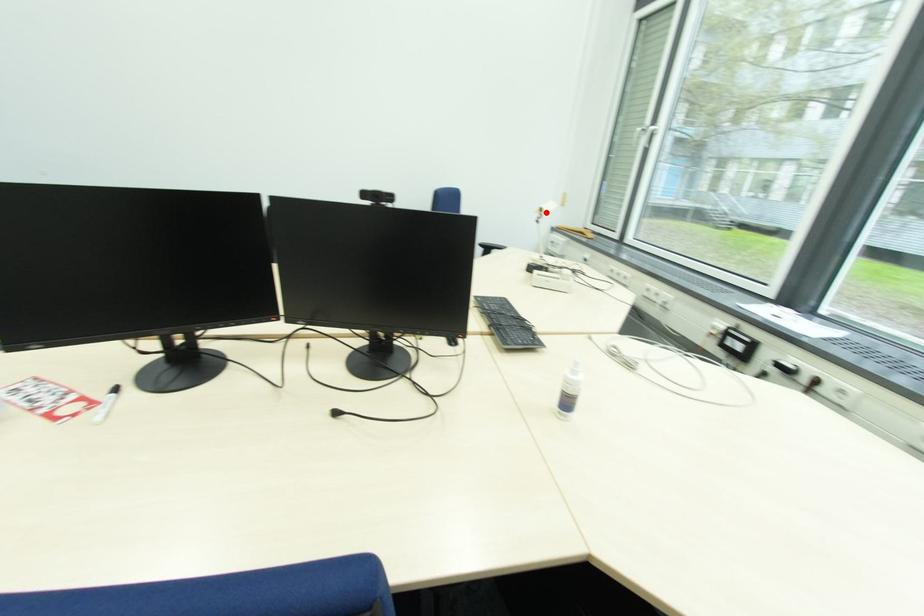
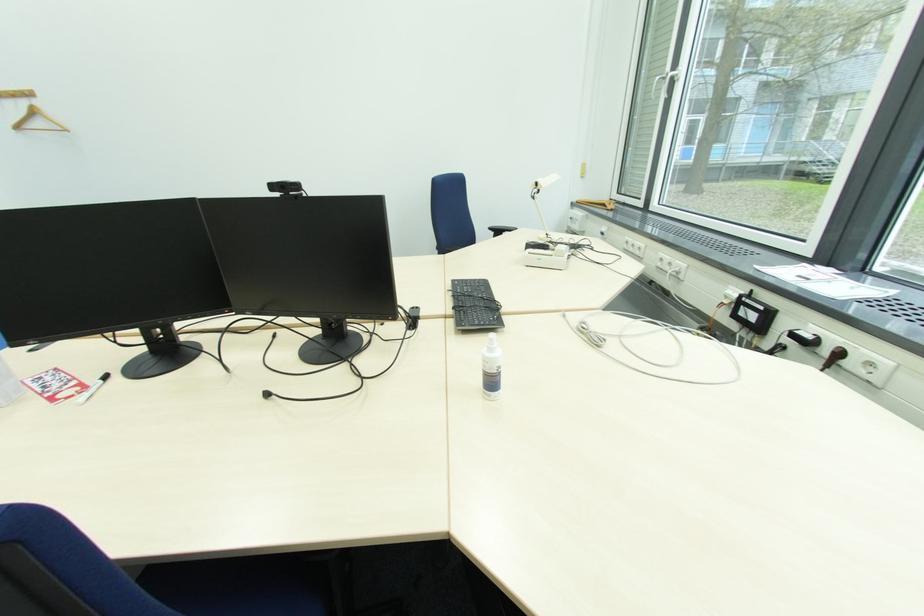
The point at the highlighted location is marked in the first image. Where is the corresponding point in the second image?

(541, 185)